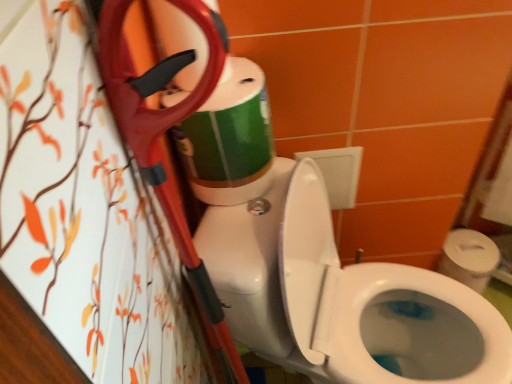
What do you see at coordinates (229, 132) in the screenshot? The height and width of the screenshot is (384, 512). I see `green matte toilet paper at upper center` at bounding box center [229, 132].

Identify the location of green matte toilet paper at upper center. The image size is (512, 384). (229, 132).

Where is `white glossy toilet at center`? white glossy toilet at center is located at coordinates (339, 295).

What do you see at coordinates (339, 295) in the screenshot?
I see `white glossy toilet at center` at bounding box center [339, 295].

This screenshot has width=512, height=384. What are the coordinates of `green matte toilet paper at upper center` in the screenshot? It's located at (x=229, y=132).

Which object is positioned more to the left, white glossy toilet at center or green matte toilet paper at upper center?

From the viewer's perspective, green matte toilet paper at upper center appears more on the left side.

Based on the photo, considering the positions of objects white glossy toilet at center and green matte toilet paper at upper center in the image provided, who is in front, white glossy toilet at center or green matte toilet paper at upper center?

Positioned in front is white glossy toilet at center.

Considering the positions of points (253, 293) and (234, 60), is point (253, 293) closer to camera compared to point (234, 60)?

Yes, it is.

From the image's perspective, is white glossy toilet at center over green matte toilet paper at upper center?

No, from the image's perspective, white glossy toilet at center is not above green matte toilet paper at upper center.

From a real-world perspective, which object rests below the other?

white glossy toilet at center, from a real-world perspective.

Considering the relative sizes of white glossy toilet at center and green matte toilet paper at upper center in the image provided, is white glossy toilet at center wider than green matte toilet paper at upper center?

Correct, the width of white glossy toilet at center exceeds that of green matte toilet paper at upper center.

Is white glossy toilet at center taller than green matte toilet paper at upper center?

Correct, white glossy toilet at center is much taller as green matte toilet paper at upper center.

Who is smaller, white glossy toilet at center or green matte toilet paper at upper center?

green matte toilet paper at upper center is smaller.

From the picture: Would you say green matte toilet paper at upper center is part of white glossy toilet at center's contents?

Definitely not — green matte toilet paper at upper center is not inside white glossy toilet at center.

Is white glossy toilet at center directly adjacent to green matte toilet paper at upper center?

No, white glossy toilet at center is not in contact with green matte toilet paper at upper center.

Is white glossy toilet at center facing away from green matte toilet paper at upper center?

No, white glossy toilet at center's orientation is not away from green matte toilet paper at upper center.

Based on the photo, how far apart are white glossy toilet at center and green matte toilet paper at upper center?

12.11 inches.

Locate an element on the screen. toilet located underneath the green matte toilet paper at upper center (from a real-world perspective) is located at coordinates (339, 295).

Can you confirm if green matte toilet paper at upper center is positioned to the left of white glossy toilet at center?

Correct, you'll find green matte toilet paper at upper center to the left of white glossy toilet at center.

Based on the photo, which object is closer to the camera taking this photo, green matte toilet paper at upper center or white glossy toilet at center?

white glossy toilet at center.

Which point is more forward, (250,94) or (464,361)?

The point (250,94) is closer to the camera.

From the image's perspective, is green matte toilet paper at upper center located beneath white glossy toilet at center?

No.

From a real-world perspective, does green matte toilet paper at upper center stand above white glossy toilet at center?

Yes.

Between green matte toilet paper at upper center and white glossy toilet at center, which one has larger width?

With larger width is white glossy toilet at center.

Considering the relative sizes of green matte toilet paper at upper center and white glossy toilet at center in the image provided, is green matte toilet paper at upper center taller than white glossy toilet at center?

No, green matte toilet paper at upper center is not taller than white glossy toilet at center.

Does green matte toilet paper at upper center have a larger size compared to white glossy toilet at center?

No.

Can white glossy toilet at center be found inside green matte toilet paper at upper center?

No, white glossy toilet at center is not a part of green matte toilet paper at upper center.

Is green matte toilet paper at upper center next to white glossy toilet at center?

green matte toilet paper at upper center and white glossy toilet at center are clearly separated.

Based on the photo, is green matte toilet paper at upper center aimed at white glossy toilet at center?

No, green matte toilet paper at upper center is not aimed at white glossy toilet at center.

Can you tell me how much green matte toilet paper at upper center and white glossy toilet at center differ in facing direction?

0.0164 degrees separate the facing orientations of green matte toilet paper at upper center and white glossy toilet at center.

How far apart are green matte toilet paper at upper center and white glossy toilet at center?

green matte toilet paper at upper center and white glossy toilet at center are 30.77 centimeters apart from each other.

This screenshot has width=512, height=384. I want to click on toilet that is in front of the green matte toilet paper at upper center, so click(339, 295).

You are a GUI agent. You are given a task and a screenshot of the screen. Output one action in this format:
    pyautogui.click(x=<x>, y=<y>)
    Task: Click on the toilet paper behind the white glossy toilet at center
    The height and width of the screenshot is (384, 512).
    Given the screenshot: What is the action you would take?
    pyautogui.click(x=229, y=132)

This screenshot has width=512, height=384. Identify the location of toilet on the right side of green matte toilet paper at upper center. (339, 295).